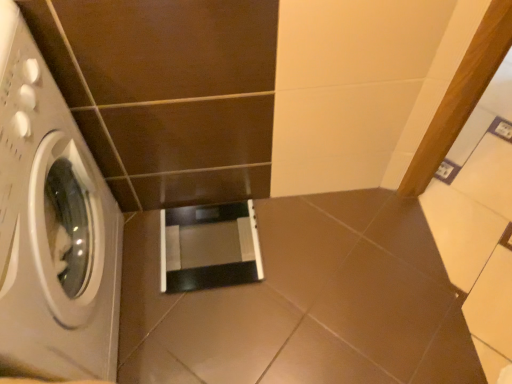
Question: Should I look upward or downward to see white glossy washing machine at left?

Choices:
 (A) down
 (B) up

Answer: (A)